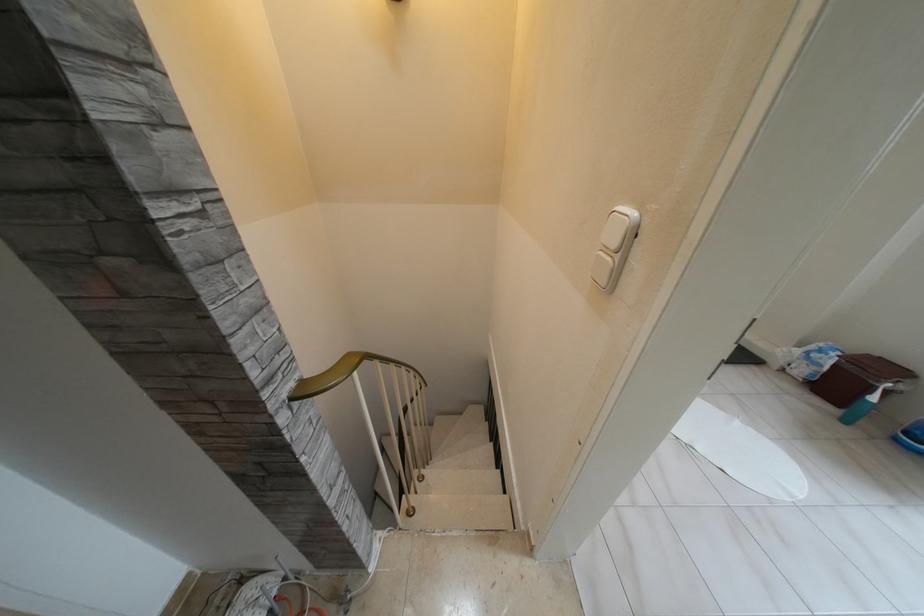
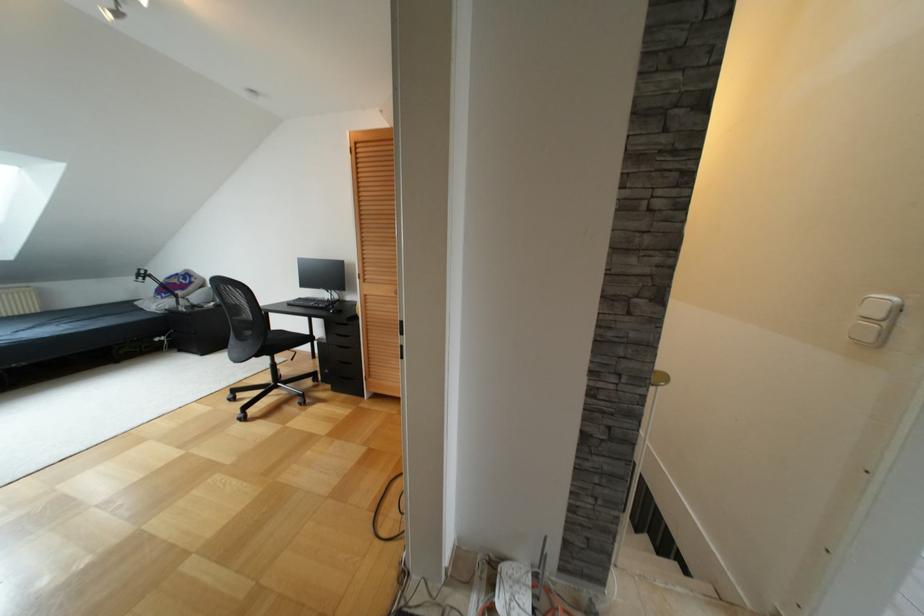
First-person continuous shooting, in which direction is the camera rotating?

The camera rotated toward left-up.